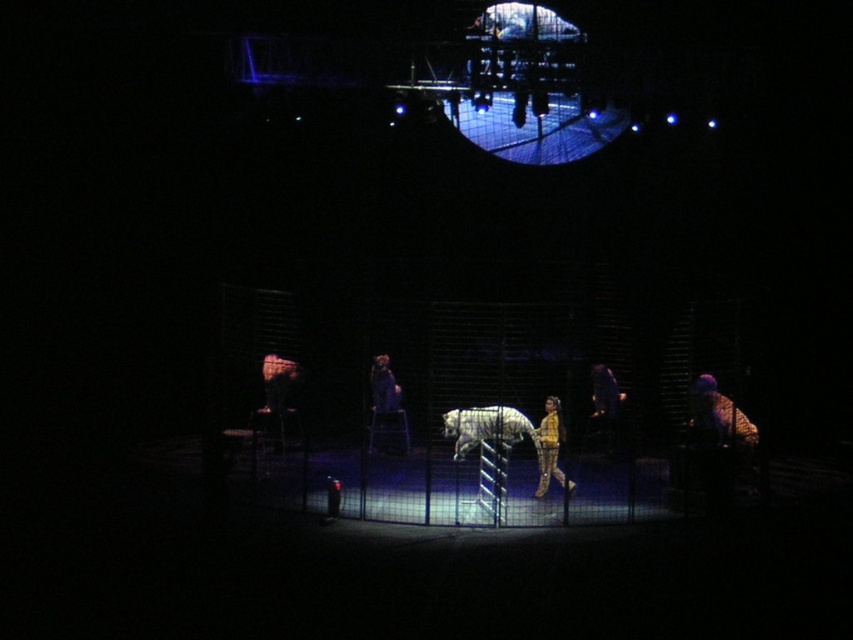
You are an audience member sitting in the front row of the stage. You notice the yellow fabric person at center and the dark blue fabric at center. Which one is closer to the ground?

The yellow fabric person at center is located below dark blue fabric at center, so the yellow fabric person at center is closer to the ground.

You are an audience member sitting in the front row of the stage. You see a yellow fabric person at center and a dark blue fabric at center. Which one is more to the right?

The yellow fabric person at center is positioned on the right side of dark blue fabric at center, so it is more to the right.

Based on the photo, based on the scene description, where is the white fur tiger at center located in terms of coordinates?

The white fur tiger at center is located at point coordinates of (486, 428).